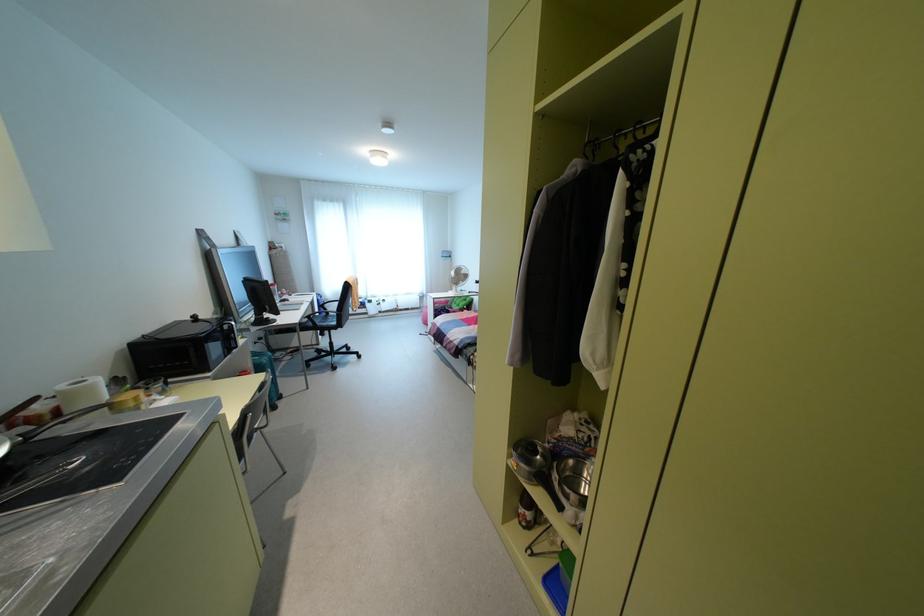
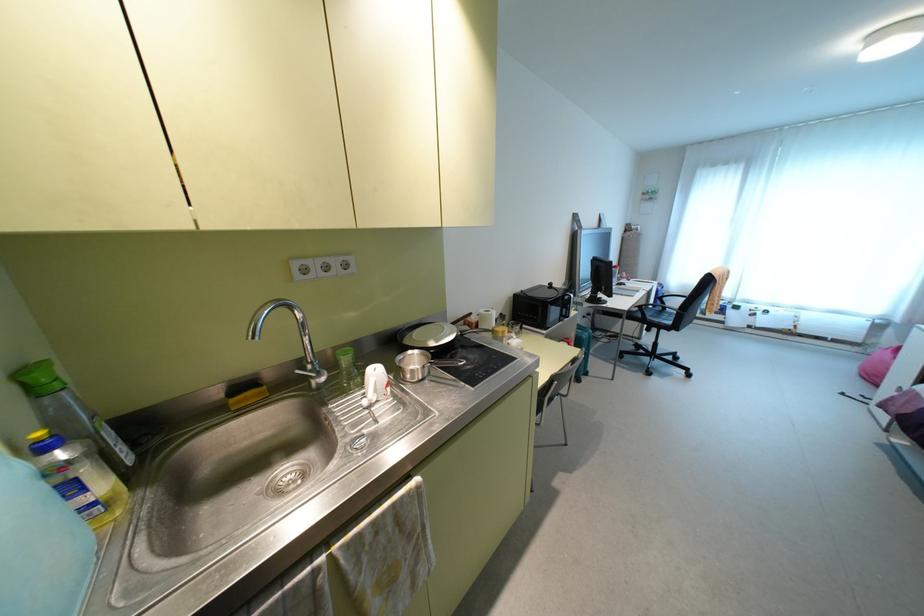
In the second image, find the point that corresponds to (333,323) in the first image.

(667, 322)